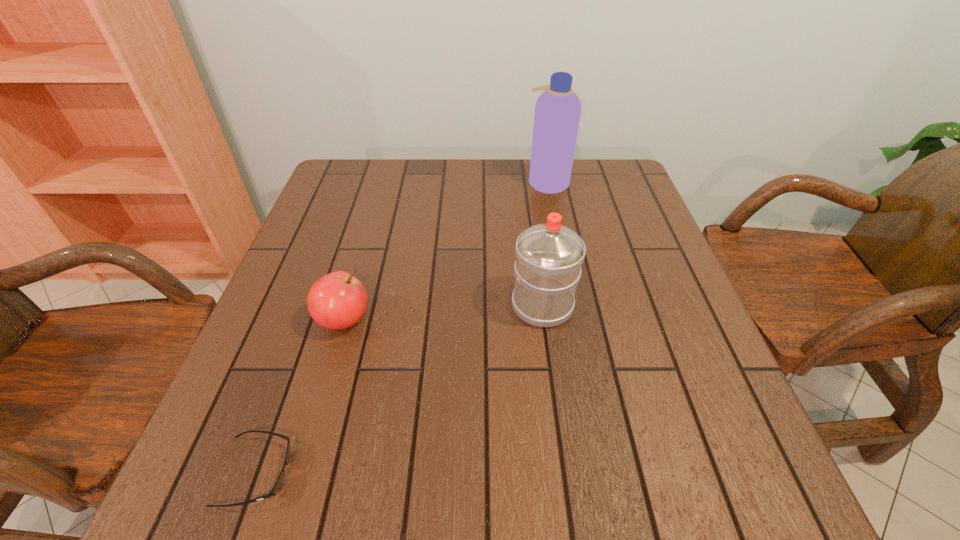
The image size is (960, 540). I want to click on shampoo, so click(557, 111).

This screenshot has width=960, height=540. Identify the location of the farthest object. (557, 111).

The height and width of the screenshot is (540, 960). In order to click on the second tallest object in this screenshot , I will do `click(549, 256)`.

Locate an element on the screen. Image resolution: width=960 pixels, height=540 pixels. the third tallest object is located at coordinates (338, 300).

Locate an element on the screen. the nearest object is located at coordinates (279, 481).

Where is `the shortest object`? This screenshot has height=540, width=960. the shortest object is located at coordinates (279, 481).

In order to click on vacant space situated on the right of the shampoo in this screenshot , I will do `click(617, 181)`.

Find the location of a particular element. This screenshot has height=540, width=960. free spot located on the handle side of the second tallest object is located at coordinates (527, 191).

This screenshot has width=960, height=540. Find the location of `blank area located on the handle side of the second tallest object`. blank area located on the handle side of the second tallest object is located at coordinates click(531, 218).

Where is `vacant area situated 0.220m on the handle side of the second tallest object`? This screenshot has height=540, width=960. vacant area situated 0.220m on the handle side of the second tallest object is located at coordinates (531, 223).